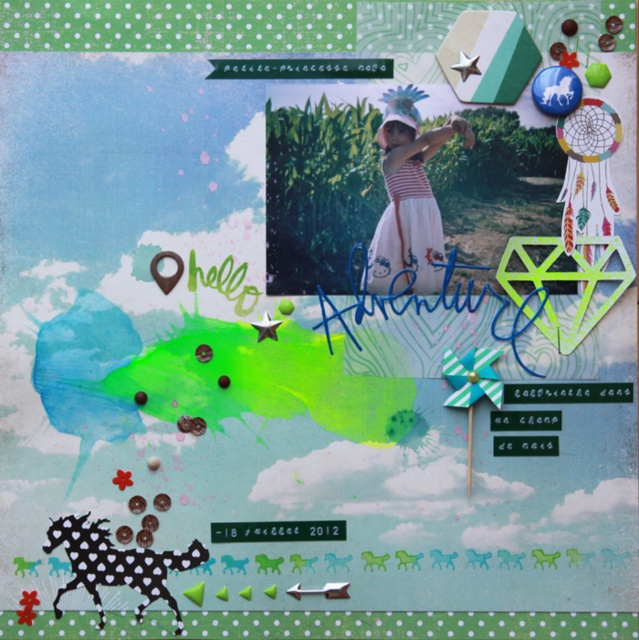
In the scrapbook layout, there is a photograph of a young girl wearing a striped cotton dress at center. The coordinates point (408, 195) mark the position of this dress. If you were to draw a vertical line through this point, would it intersect the word Adventure?

The vertical line through point (408, 195) would not intersect the word Adventure because the word Adventure is displayed above the photograph of the young girl, who is positioned at the center of the layout. Since the point is at the center where the dress is located, and the word is above it, the vertical line would pass through the dress area but not reach the word above.

From the picture: You are designing a scrapbook layout and want to place a decorative sticker between the striped cotton dress at center and the word Adventure. The sticker you have is 0.3 meters wide. Is there enough space between them to fit the sticker without overlapping?

The distance between the striped cotton dress at center and the word Adventure is 1.45 meters. Since the sticker is only 0.3 meters wide, there is sufficient space to place it between them without overlapping.

You are designing a digital scrapbook layout and want to place a decorative border around the striped cotton dress at center. Given the coordinates provided, where should you position the border relative to the dress?

The striped cotton dress at center is located at point (408, 195), so you should position the border around these coordinates to ensure it surrounds the dress properly.